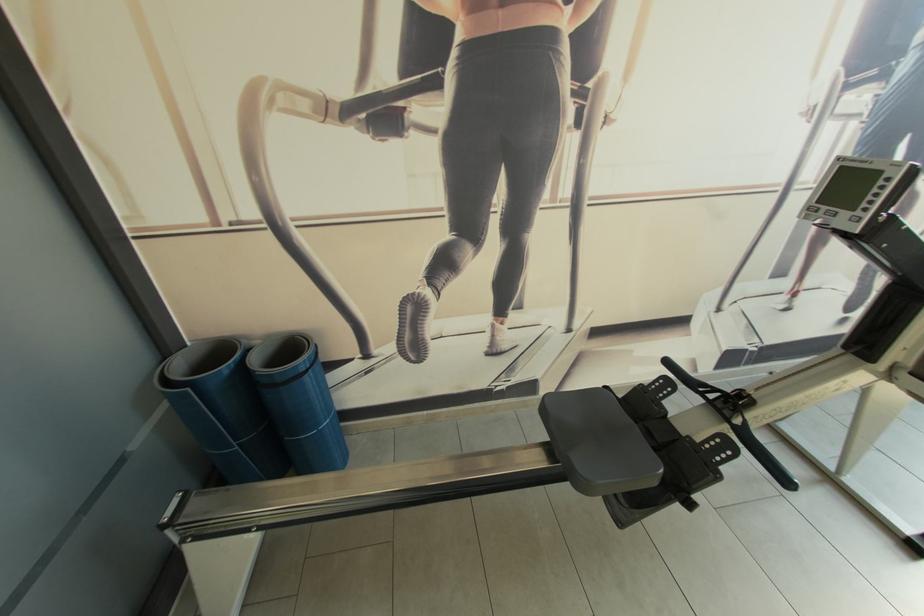
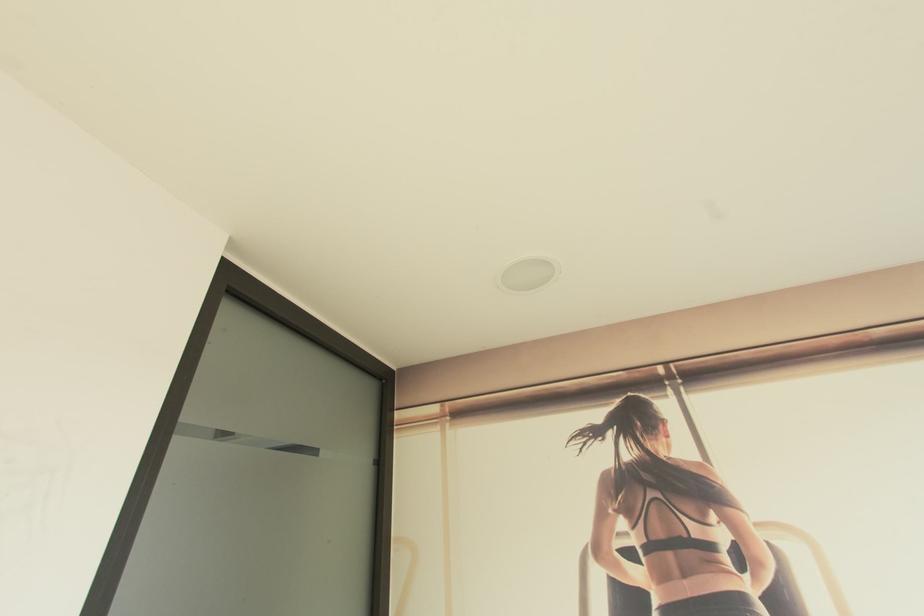
Based on the continuous images, in which direction is the camera rotating?

The camera rotated toward left-up.